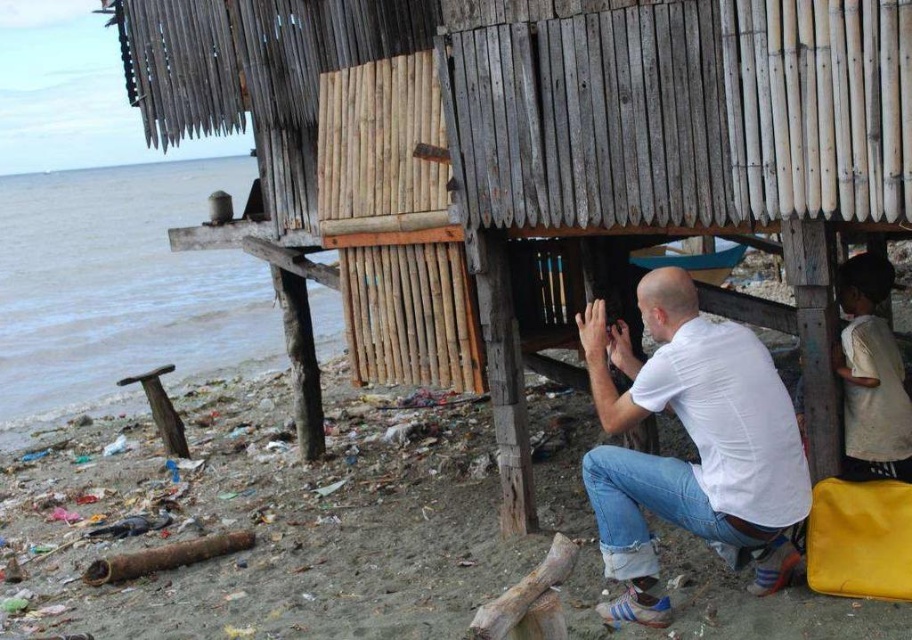
Which of these two, dirty sand at lower left or blue water at lower left, stands shorter?

dirty sand at lower left is shorter.

Is dirty sand at lower left further to camera compared to blue water at lower left?

That is False.

Does point (6, 627) lie behind point (67, 280)?

No, (6, 627) is closer to viewer.

Locate an element on the screen. dirty sand at lower left is located at coordinates (264, 524).

Which is in front, point (151, 339) or point (776, 472)?

Point (776, 472)

Which is below, blue water at lower left or white matte shirt at lower center?

Positioned lower is white matte shirt at lower center.

Who is more distant from viewer, (197,356) or (666,352)?

The point (197,356) is more distant.

Locate an element on the screen. This screenshot has height=640, width=912. blue water at lower left is located at coordinates (120, 285).

Does wooden hut at center appear over white cotton shirt at lower right?

Yes, wooden hut at center is above white cotton shirt at lower right.

Who is shorter, wooden hut at center or white cotton shirt at lower right?

Standing shorter between the two is white cotton shirt at lower right.

Is point (527, 522) farther from camera compared to point (871, 381)?

Yes, it is.

The height and width of the screenshot is (640, 912). I want to click on wooden hut at center, so click(x=544, y=160).